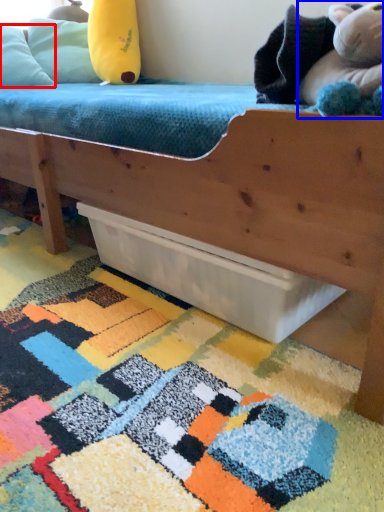
Question: Which object appears closest to the camera in this image, pillow (highlighted by a red box) or toy (highlighted by a blue box)?

Choices:
 (A) pillow
 (B) toy

Answer: (B)